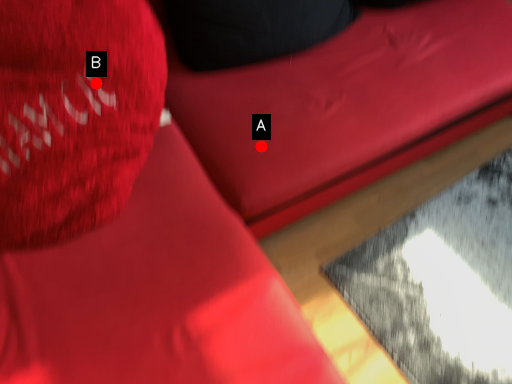
Question: Two points are circled on the image, labeled by A and B beside each circle. Which point appears closest to the camera in this image?

Choices:
 (A) A is closer
 (B) B is closer

Answer: (B)